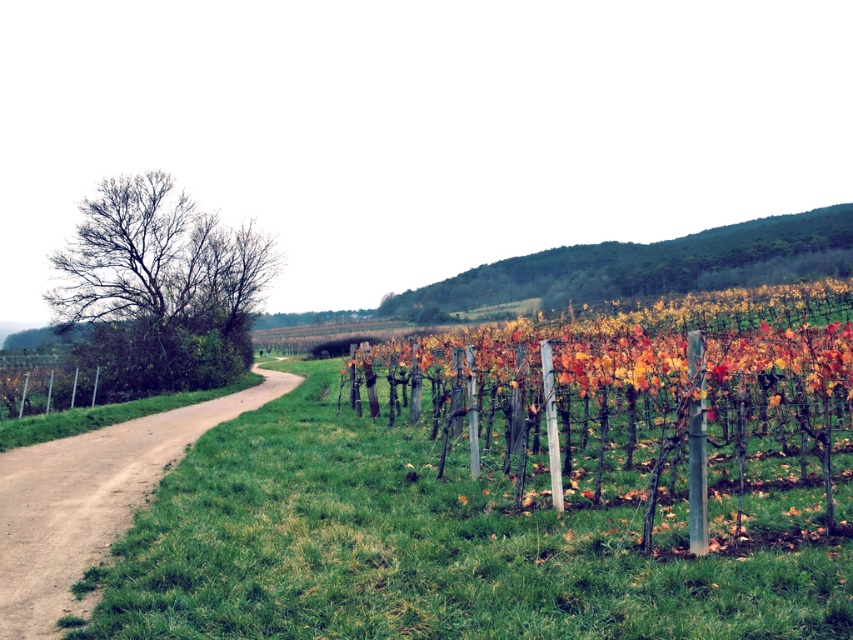
You are standing at the point marked by the coordinate point at point (90, 500). Looking around, you see the brown dirt track at left. Which direction should you walk to stay on the dirt path?

The point (90, 500) marks the brown dirt track at left, so you should walk along the direction of the dirt path to stay on it.